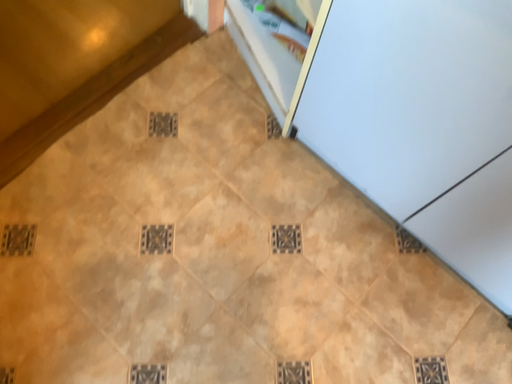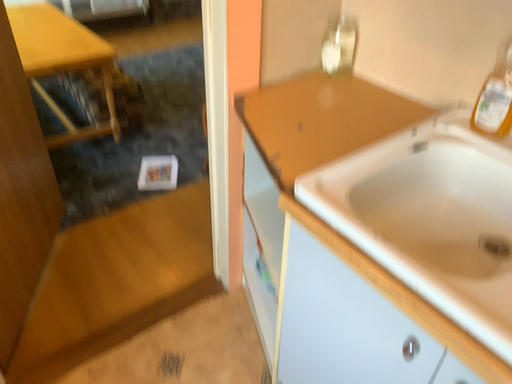
Question: Which way did the camera rotate in the video?

Choices:
 (A) rotated downward
 (B) rotated upward

Answer: (B)